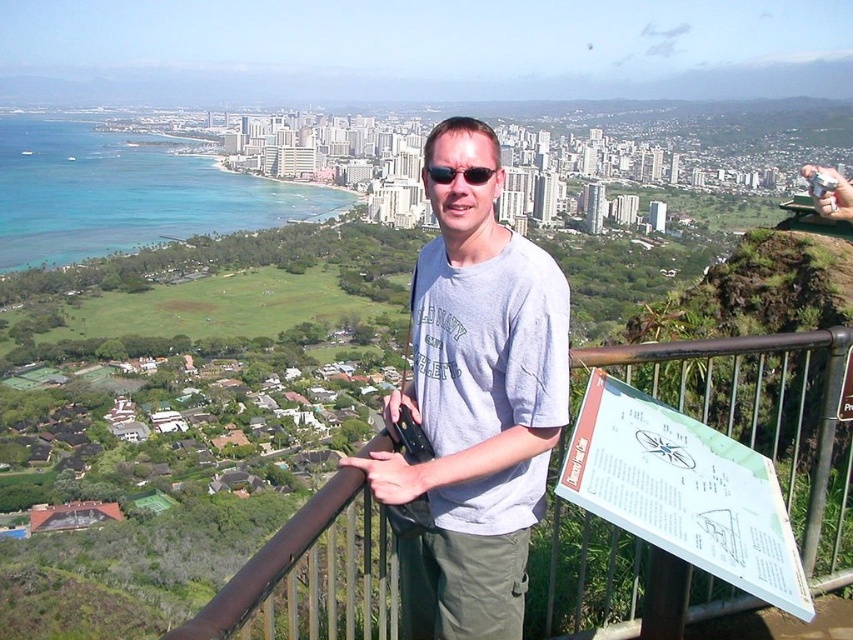
Question: Which of the following is the closest to the observer?

Choices:
 (A) (432, 179)
 (B) (329, 499)

Answer: (B)

Question: Is brown metal/rail at center below black plastic sunglasses at center?

Choices:
 (A) yes
 (B) no

Answer: (A)

Question: Among these objects, which one is farthest from the camera?

Choices:
 (A) gray cotton t-shirt at center
 (B) black plastic sunglasses at center
 (C) brown metal/rail at center

Answer: (B)

Question: Can you confirm if brown metal/rail at center is thinner than black plastic sunglasses at center?

Choices:
 (A) yes
 (B) no

Answer: (B)

Question: Can you confirm if brown metal/rail at center is positioned below black plastic sunglasses at center?

Choices:
 (A) yes
 (B) no

Answer: (A)

Question: Which is nearer to the black plastic sunglasses at center?

Choices:
 (A) gray cotton t-shirt at center
 (B) brown metal/rail at center

Answer: (A)